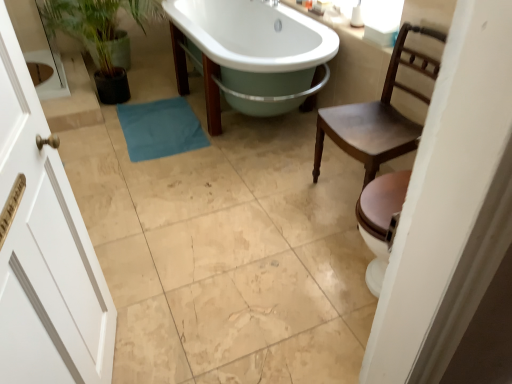
Question: Is the surface of white glossy bathtub at center in direct contact with brown wooden chair at right?

Choices:
 (A) no
 (B) yes

Answer: (A)

Question: From the image's perspective, would you say white glossy bathtub at center is positioned over brown wooden chair at right?

Choices:
 (A) no
 (B) yes

Answer: (B)

Question: Does white glossy bathtub at center have a lesser width compared to brown wooden chair at right?

Choices:
 (A) no
 (B) yes

Answer: (A)

Question: Could brown wooden chair at right be considered to be inside white glossy bathtub at center?

Choices:
 (A) no
 (B) yes

Answer: (A)

Question: Are white glossy bathtub at center and brown wooden chair at right located far from each other?

Choices:
 (A) yes
 (B) no

Answer: (B)

Question: Is the position of white glossy bathtub at center less distant than that of brown wooden chair at right?

Choices:
 (A) no
 (B) yes

Answer: (A)

Question: Would you say brown wooden chair at right contains blue fabric bath towel at center?

Choices:
 (A) no
 (B) yes

Answer: (A)

Question: Is brown wooden chair at right further to camera compared to blue fabric bath towel at center?

Choices:
 (A) yes
 (B) no

Answer: (B)

Question: From a real-world perspective, is brown wooden chair at right physically below blue fabric bath towel at center?

Choices:
 (A) yes
 (B) no

Answer: (B)

Question: Is brown wooden chair at right positioned before blue fabric bath towel at center?

Choices:
 (A) no
 (B) yes

Answer: (B)

Question: Is brown wooden chair at right bigger than blue fabric bath towel at center?

Choices:
 (A) yes
 (B) no

Answer: (A)

Question: Does brown wooden chair at right have a lesser height compared to blue fabric bath towel at center?

Choices:
 (A) yes
 (B) no

Answer: (B)

Question: Can you confirm if white glossy bathtub at center is wider than green matte plant at left?

Choices:
 (A) no
 (B) yes

Answer: (B)